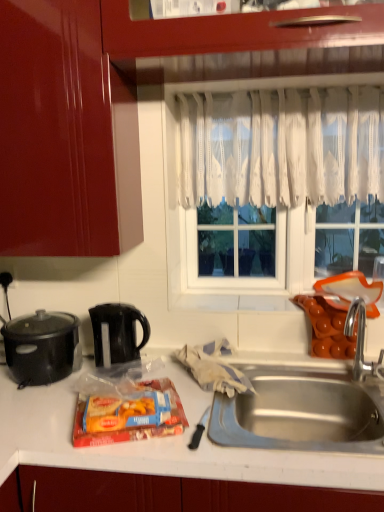
Question: Does matte plastic snack pack at center turn towards black plastic kettle at center-left, which is counted as the second kitchen appliance, starting from the left?

Choices:
 (A) yes
 (B) no

Answer: (B)

Question: Can you confirm if matte plastic snack pack at center is positioned to the right of black plastic kettle at center-left, which is the first kitchen appliance from right to left?

Choices:
 (A) yes
 (B) no

Answer: (A)

Question: From the image's perspective, is matte plastic snack pack at center located above black plastic kettle at center-left, which is the first kitchen appliance from right to left?

Choices:
 (A) no
 (B) yes

Answer: (A)

Question: From a real-world perspective, is matte plastic snack pack at center on black plastic kettle at center-left, which is the first kitchen appliance from right to left?

Choices:
 (A) yes
 (B) no

Answer: (B)

Question: Is matte plastic snack pack at center not within black plastic kettle at center-left, which is the first kitchen appliance from right to left?

Choices:
 (A) yes
 (B) no

Answer: (A)

Question: From a real-world perspective, relative to white lace curtain at center, is black plastic kettle at center-left, which is the first kitchen appliance from right to left, vertically above or below?

Choices:
 (A) below
 (B) above

Answer: (A)

Question: Is black plastic kettle at center-left, which is the first kitchen appliance from right to left, in front of or behind white lace curtain at center in the image?

Choices:
 (A) front
 (B) behind

Answer: (A)

Question: Looking at their shapes, would you say black plastic kettle at center-left, which is the first kitchen appliance from right to left, is wider or thinner than white lace curtain at center?

Choices:
 (A) thin
 (B) wide

Answer: (B)

Question: Does point (117, 357) appear closer or farther from the camera than point (279, 249)?

Choices:
 (A) farther
 (B) closer

Answer: (B)

Question: Looking at the image, does black plastic kettle at center-left, which is counted as the second kitchen appliance, starting from the left, seem bigger or smaller compared to matte plastic snack pack at center?

Choices:
 (A) small
 (B) big

Answer: (B)

Question: Considering the relative positions of black plastic kettle at center-left, which is counted as the second kitchen appliance, starting from the left, and matte plastic snack pack at center in the image provided, is black plastic kettle at center-left, which is counted as the second kitchen appliance, starting from the left, to the left or to the right of matte plastic snack pack at center?

Choices:
 (A) right
 (B) left

Answer: (B)

Question: From a real-world perspective, is black plastic kettle at center-left, which is counted as the second kitchen appliance, starting from the left, physically located above or below matte plastic snack pack at center?

Choices:
 (A) below
 (B) above

Answer: (B)

Question: From their relative heights in the image, would you say black plastic kettle at center-left, which is counted as the second kitchen appliance, starting from the left, is taller or shorter than matte plastic snack pack at center?

Choices:
 (A) tall
 (B) short

Answer: (A)

Question: Is point (294, 152) closer or farther from the camera than point (99, 345)?

Choices:
 (A) closer
 (B) farther

Answer: (B)

Question: Is white lace curtain at center wider or thinner than black plastic kettle at center-left, which is the first kitchen appliance from right to left?

Choices:
 (A) thin
 (B) wide

Answer: (A)